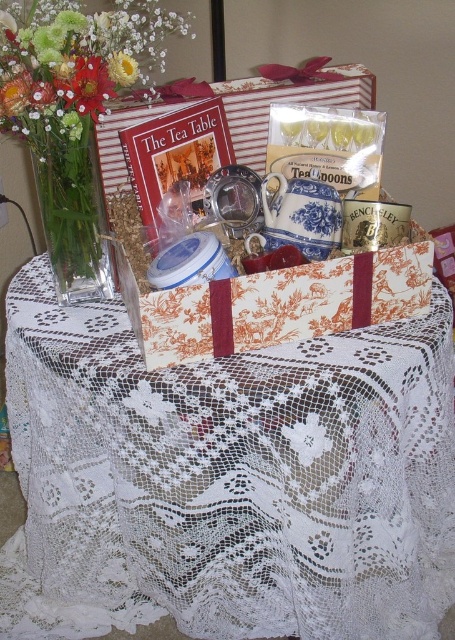
Can you confirm if white lace tablecloth at center is taller than clear glass vase at left?

Yes, white lace tablecloth at center is taller than clear glass vase at left.

Who is more distant from viewer, (86, 432) or (62, 164)?

The point (86, 432) is behind.

Find the location of a particular element. white lace tablecloth at center is located at coordinates (227, 480).

Is clear glass vase at left to the right of yellow fabric flower at upper left from the viewer's perspective?

No, clear glass vase at left is not to the right of yellow fabric flower at upper left.

Is clear glass vase at left wider than yellow fabric flower at upper left?

Yes.

Find the location of a particular element. The image size is (455, 640). clear glass vase at left is located at coordinates (74, 218).

Is red matte flower at upper left smaller than yellow fabric flower at upper left?

Actually, red matte flower at upper left might be larger than yellow fabric flower at upper left.

Does point (59, 81) come in front of point (126, 54)?

Yes, point (59, 81) is closer to viewer.

Based on the photo, who is more distant from viewer, (82, 68) or (121, 60)?

Point (121, 60)

This screenshot has height=640, width=455. Identify the location of red matte flower at upper left. (86, 84).